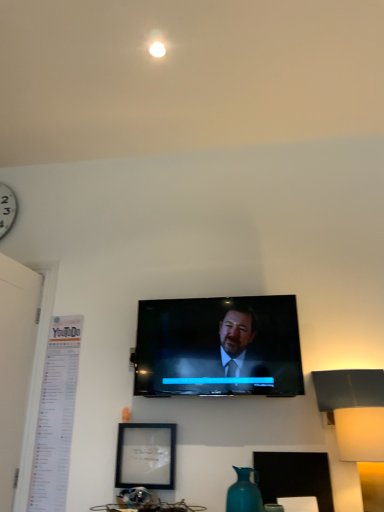
Image resolution: width=384 pixels, height=512 pixels. Describe the element at coordinates (218, 347) in the screenshot. I see `matte black tv at center` at that location.

This screenshot has height=512, width=384. In order to click on white matte table lamp at right in this screenshot , I will do `click(357, 422)`.

Find the location of a particular element. Image resolution: width=384 pixels, height=512 pixels. matte black picture frame at lower center is located at coordinates (146, 456).

The height and width of the screenshot is (512, 384). I want to click on teal ceramic vase at lower center, so pos(244,492).

Identify the location of matte black tv at center. (218, 347).

Is point (354, 446) positioned before point (247, 314)?

That is True.

Which of these two, white matte table lamp at right or matte black tv at center, stands taller?

With more height is matte black tv at center.

From a real-world perspective, is white matte table lamp at right under matte black tv at center?

Correct, in the physical world, white matte table lamp at right is lower than matte black tv at center.

Relative to matte black tv at center, is white matte table lamp at right in front or behind?

In the image, white matte table lamp at right appears in front of matte black tv at center.

Does matte black picture frame at lower center contain teal ceramic vase at lower center?

That's incorrect, teal ceramic vase at lower center is not inside matte black picture frame at lower center.

Is matte black picture frame at lower center oriented towards teal ceramic vase at lower center?

No, matte black picture frame at lower center does not turn towards teal ceramic vase at lower center.

Can you confirm if matte black picture frame at lower center is taller than teal ceramic vase at lower center?

Yes, matte black picture frame at lower center is taller than teal ceramic vase at lower center.

How distant is matte black tv at center from white matte table lamp at right?

15.29 inches.

Is matte black tv at center far away from white matte table lamp at right?

They are positioned close to each other.

Is point (288, 330) closer or farther from the camera than point (367, 373)?

Point (288, 330) is positioned farther from the camera compared to point (367, 373).

Between matte black tv at center and white matte table lamp at right, which one has less height?

white matte table lamp at right.

Can matte black picture frame at lower center be found inside teal ceramic vase at lower center?

No, teal ceramic vase at lower center does not contain matte black picture frame at lower center.

From the image's perspective, which is below, teal ceramic vase at lower center or matte black picture frame at lower center?

teal ceramic vase at lower center appears lower in the image.

In the scene shown: Is there a large distance between teal ceramic vase at lower center and matte black picture frame at lower center?

They are positioned close to each other.

Considering the relative sizes of teal ceramic vase at lower center and matte black picture frame at lower center in the image provided, is teal ceramic vase at lower center smaller than matte black picture frame at lower center?

No.

Is the position of teal ceramic vase at lower center less distant than that of white matte table lamp at right?

That is False.

From a real-world perspective, which is physically below, teal ceramic vase at lower center or white matte table lamp at right?

From a 3D spatial view, teal ceramic vase at lower center is below.

Is teal ceramic vase at lower center outside of white matte table lamp at right?

Absolutely, teal ceramic vase at lower center is external to white matte table lamp at right.

Is teal ceramic vase at lower center bigger than white matte table lamp at right?

Actually, teal ceramic vase at lower center might be smaller than white matte table lamp at right.

From the image's perspective, is white matte table lamp at right over matte black picture frame at lower center?

Yes, from the image's perspective, white matte table lamp at right is over matte black picture frame at lower center.

At what (x,y) coordinates should I click in order to perform the action: click on table lamp on the right of matte black picture frame at lower center. Please return your answer as a coordinate pair (x, y). Looking at the image, I should click on (357, 422).

Who is smaller, white matte table lamp at right or matte black picture frame at lower center?

Smaller between the two is matte black picture frame at lower center.

Is matte black picture frame at lower center to the left or to the right of white matte table lamp at right in the image?

matte black picture frame at lower center is positioned on white matte table lamp at right's left side.

From the image's perspective, who appears lower, matte black picture frame at lower center or white matte table lamp at right?

matte black picture frame at lower center appears lower in the image.

From the picture: Which is closer, (167, 452) or (382, 474)?

Point (167, 452) is farther from the camera than point (382, 474).

Locate an element on the screen. Image resolution: width=384 pixels, height=512 pixels. tv show behind the white matte table lamp at right is located at coordinates (218, 347).

You are a GUI agent. You are given a task and a screenshot of the screen. Output one action in this format:
    pyautogui.click(x=<x>, y=<y>)
    Task: Click on the vase that is below the matte black picture frame at lower center (from the image's perspective)
    
    Given the screenshot: What is the action you would take?
    pyautogui.click(x=244, y=492)

When comparing their distances from matte black tv at center, does matte black picture frame at lower center or white matte table lamp at right seem closer?

matte black picture frame at lower center lies closer to matte black tv at center than the other object.

Consider the image. Estimate the real-world distances between objects in this image. Which object is closer to matte black picture frame at lower center, teal ceramic vase at lower center or matte black tv at center?

Among the two, matte black tv at center is located nearer to matte black picture frame at lower center.

Considering their positions, is matte black tv at center positioned closer to teal ceramic vase at lower center than white matte table lamp at right?

Among the two, white matte table lamp at right is located nearer to teal ceramic vase at lower center.

From the image, which object appears to be nearer to teal ceramic vase at lower center, white matte table lamp at right or matte black picture frame at lower center?

matte black picture frame at lower center is positioned closer to the anchor teal ceramic vase at lower center.

When comparing their distances from matte black picture frame at lower center, does white matte table lamp at right or matte black tv at center seem further?

white matte table lamp at right.

Which object lies further to the anchor point matte black tv at center, white matte table lamp at right or matte black picture frame at lower center?

white matte table lamp at right.

Based on the photo, considering their positions, is matte black tv at center positioned further to teal ceramic vase at lower center than matte black picture frame at lower center?

matte black tv at center.

Which object lies further to the anchor point white matte table lamp at right, matte black tv at center or teal ceramic vase at lower center?

Based on the image, teal ceramic vase at lower center appears to be further to white matte table lamp at right.

At what (x,y) coordinates should I click in order to perform the action: click on vase situated between matte black picture frame at lower center and white matte table lamp at right from left to right. Please return your answer as a coordinate pair (x, y). The image size is (384, 512). Looking at the image, I should click on [x=244, y=492].

Identify the location of tv show between matte black picture frame at lower center and white matte table lamp at right. The height and width of the screenshot is (512, 384). (x=218, y=347).

Locate an element on the screen. The image size is (384, 512). vase between matte black tv at center and white matte table lamp at right from left to right is located at coordinates (244, 492).

You are a GUI agent. You are given a task and a screenshot of the screen. Output one action in this format:
    pyautogui.click(x=<x>, y=<y>)
    Task: Click on the picture frame between matte black tv at center and teal ceramic vase at lower center in the up-down direction
    This screenshot has width=384, height=512.
    Given the screenshot: What is the action you would take?
    pyautogui.click(x=146, y=456)